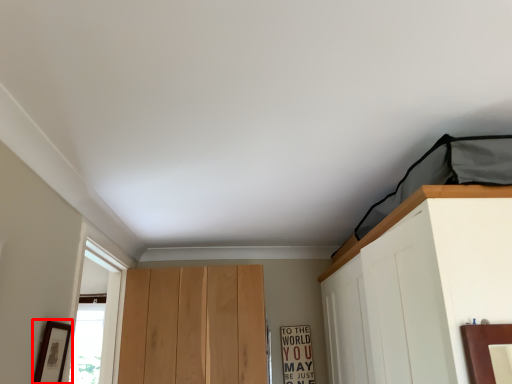
Question: Observing the image, what is the correct spatial positioning of picture frame (annotated by the red box) in reference to warning sign?

Choices:
 (A) right
 (B) left

Answer: (B)